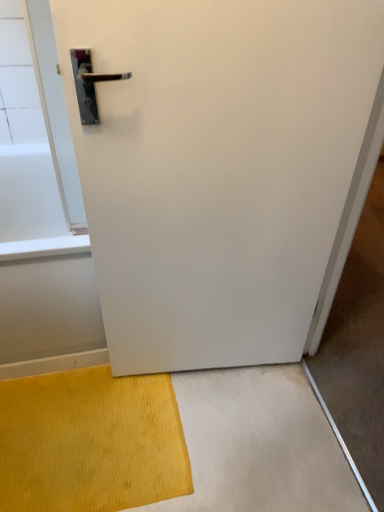
Locate an element on the screen. blank space situated above yellow textured mat at lower left (from a real-world perspective) is located at coordinates (74, 438).